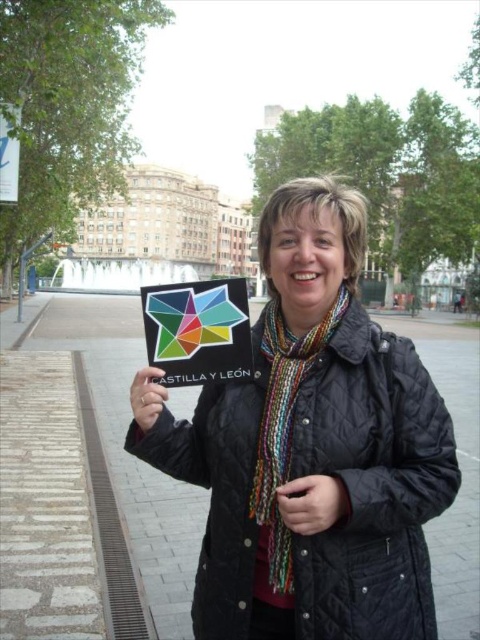
Question: Which point is farther to the camera?

Choices:
 (A) multicolored scarf at center
 (B) multicolored knitted scarf at center

Answer: (B)

Question: Does multicolored knitted scarf at center appear under matte black card at center?

Choices:
 (A) no
 (B) yes

Answer: (B)

Question: Is black quilted jacket at center below matte black card at center?

Choices:
 (A) yes
 (B) no

Answer: (B)

Question: Can you confirm if multicolored knitted scarf at center is positioned to the right of matte plastic sign at center?

Choices:
 (A) yes
 (B) no

Answer: (A)

Question: Which is farther from the matte black card at center?

Choices:
 (A) multicolored scarf at center
 (B) matte plastic sign at center
 (C) multicolored knitted scarf at center

Answer: (A)

Question: Considering the real-world distances, which object is farthest from the matte black card at center?

Choices:
 (A) matte plastic sign at center
 (B) black quilted jacket at center
 (C) multicolored knitted scarf at center

Answer: (B)